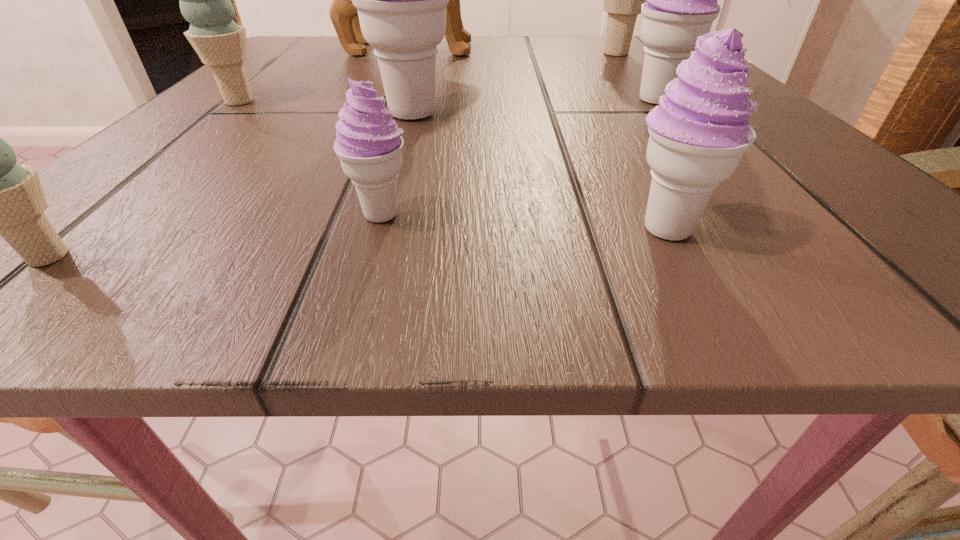
Locate which purple icecream is the second closest to the second nearest blue ice cream. Please provide its 2D coordinates. Your answer should be formatted as a tuple, i.e. [(x, y)], where the tuple contains the x and y coordinates of a point satisfying the conditions above.

[(369, 144)]

Where is `purple icecream identified as the fourth closest to the second nearest blue ice cream`? Image resolution: width=960 pixels, height=540 pixels. purple icecream identified as the fourth closest to the second nearest blue ice cream is located at coordinates (681, 4).

Locate an element on the screen. The height and width of the screenshot is (540, 960). blue ice cream that can be found as the third closest to the smallest purple icecream is located at coordinates (622, 0).

Point out which blue ice cream is positioned as the second nearest to the puppy. Please provide its 2D coordinates. Your answer should be formatted as a tuple, i.e. [(x, y)], where the tuple contains the x and y coordinates of a point satisfying the conditions above.

[(204, 0)]

At what (x,y) coordinates should I click in order to perform the action: click on free region that satisfies the following two spatial constraints: 1. at the face of the puppy; 2. on the left side of the biggest purple icecream. Please return your answer as a coordinate pair (x, y). The image size is (960, 540). Looking at the image, I should click on (393, 114).

This screenshot has height=540, width=960. Find the location of `vacant area in the image that satisfies the following two spatial constraints: 1. on the front side of the rightmost blue ice cream; 2. on the right side of the rightmost purple icecream`. vacant area in the image that satisfies the following two spatial constraints: 1. on the front side of the rightmost blue ice cream; 2. on the right side of the rightmost purple icecream is located at coordinates (656, 101).

The height and width of the screenshot is (540, 960). I want to click on vacant area that satisfies the following two spatial constraints: 1. on the back side of the farthest ice cream; 2. at the face of the puppy, so click(x=612, y=49).

Identify the location of vacant space that satisfies the following two spatial constraints: 1. at the face of the rightmost blue ice cream; 2. on the left side of the tallest object. Image resolution: width=960 pixels, height=540 pixels. (417, 53).